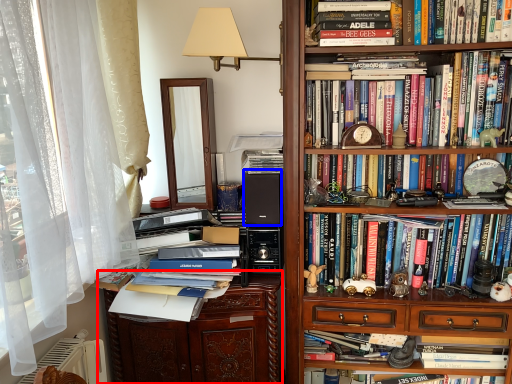
Question: Which point is closer to the camera, file cabinet (highlighted by a red box) or speaker (highlighted by a blue box)?

Choices:
 (A) file cabinet
 (B) speaker

Answer: (A)